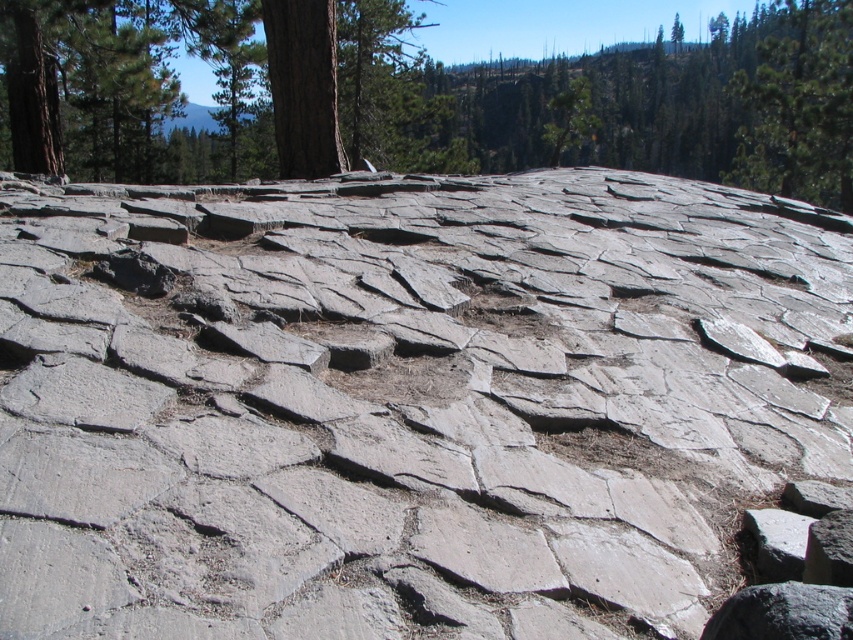
Question: Which of these objects is positioned closest to the brown rough tree at upper center?

Choices:
 (A) gray rough stone at center
 (B) green textured tree at upper right

Answer: (B)

Question: Which object is farther from the camera taking this photo?

Choices:
 (A) gray rough stone at center
 (B) brown rough tree at upper center
 (C) green textured tree at upper right

Answer: (C)

Question: Does brown rough tree at upper center appear over green textured tree at upper right?

Choices:
 (A) no
 (B) yes

Answer: (B)

Question: Among these objects, which one is farthest from the camera?

Choices:
 (A) gray rough stone at center
 (B) brown rough tree at upper center
 (C) green textured tree at upper right

Answer: (C)

Question: Can you confirm if gray rough stone at center is bigger than green textured tree at upper right?

Choices:
 (A) yes
 (B) no

Answer: (B)

Question: Where is gray rough stone at center located in relation to green textured tree at upper right in the image?

Choices:
 (A) right
 (B) left

Answer: (B)